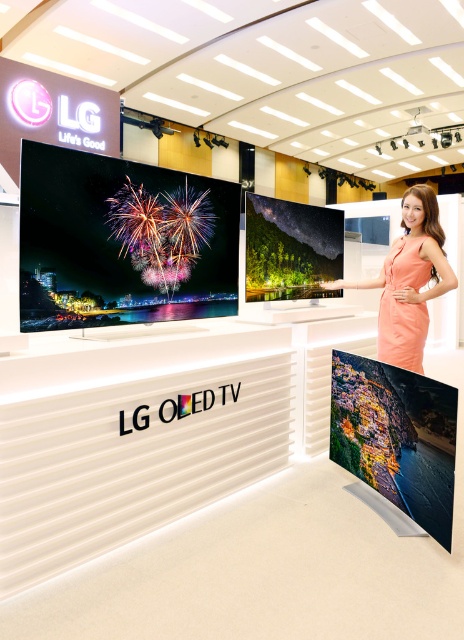
Question: Does orange satin dress at upper right have a smaller size compared to orange satin dress at right?

Choices:
 (A) no
 (B) yes

Answer: (A)

Question: From the image, what is the correct spatial relationship of orange satin dress at upper right in relation to orange satin dress at right?

Choices:
 (A) above
 (B) below

Answer: (A)

Question: Among these points, which one is farthest from the camera?

Choices:
 (A) (386, 342)
 (B) (444, 273)

Answer: (A)

Question: Does orange satin dress at upper right appear under orange satin dress at right?

Choices:
 (A) yes
 (B) no

Answer: (B)